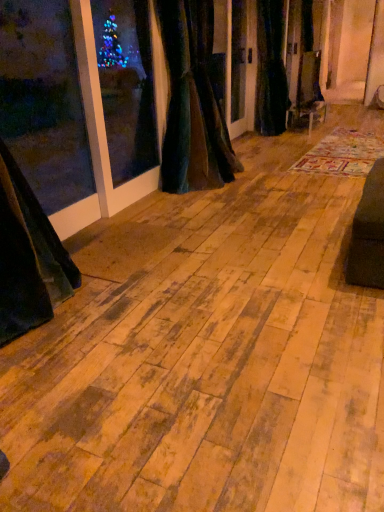
Question: Is the depth of multicolored woven rug at center greater than that of velvet dark green curtain at center, the 1th curtain when ordered from left to right?

Choices:
 (A) yes
 (B) no

Answer: (A)

Question: Is multicolored woven rug at center looking in the opposite direction of velvet dark green curtain at center, which is the 1th curtain from front to back?

Choices:
 (A) yes
 (B) no

Answer: (B)

Question: Is multicolored woven rug at center next to velvet dark green curtain at center, the 1th curtain when ordered from left to right?

Choices:
 (A) no
 (B) yes

Answer: (A)

Question: Is there a large distance between multicolored woven rug at center and velvet dark green curtain at center, placed as the second curtain when sorted from right to left?

Choices:
 (A) yes
 (B) no

Answer: (A)

Question: Is multicolored woven rug at center taller than velvet dark green curtain at center, which is the 1th curtain from front to back?

Choices:
 (A) yes
 (B) no

Answer: (B)

Question: Is multicolored woven rug at center at the right side of velvet dark green curtain at center, which is the 1th curtain from front to back?

Choices:
 (A) no
 (B) yes

Answer: (B)

Question: Is velvet dark green curtain at center, the 1th curtain in the back-to-front sequence, not close to multicolored woven rug at center?

Choices:
 (A) yes
 (B) no

Answer: (A)

Question: Considering the relative sizes of velvet dark green curtain at center, the 1th curtain in the back-to-front sequence, and multicolored woven rug at center in the image provided, is velvet dark green curtain at center, the 1th curtain in the back-to-front sequence, smaller than multicolored woven rug at center?

Choices:
 (A) no
 (B) yes

Answer: (A)

Question: From a real-world perspective, is velvet dark green curtain at center, which is the second curtain in left-to-right order, physically below multicolored woven rug at center?

Choices:
 (A) yes
 (B) no

Answer: (B)

Question: Does velvet dark green curtain at center, which ranks as the 1th curtain in right-to-left order, come in front of multicolored woven rug at center?

Choices:
 (A) no
 (B) yes

Answer: (A)

Question: Does velvet dark green curtain at center, the 1th curtain in the back-to-front sequence, have a lesser height compared to multicolored woven rug at center?

Choices:
 (A) yes
 (B) no

Answer: (B)

Question: From the image's perspective, does velvet dark green curtain at center, which is the second curtain in left-to-right order, appear higher than multicolored woven rug at center?

Choices:
 (A) yes
 (B) no

Answer: (A)

Question: Can you confirm if multicolored woven rug at center is shorter than velvet dark green curtain at center, which ranks as the 1th curtain in right-to-left order?

Choices:
 (A) yes
 (B) no

Answer: (A)